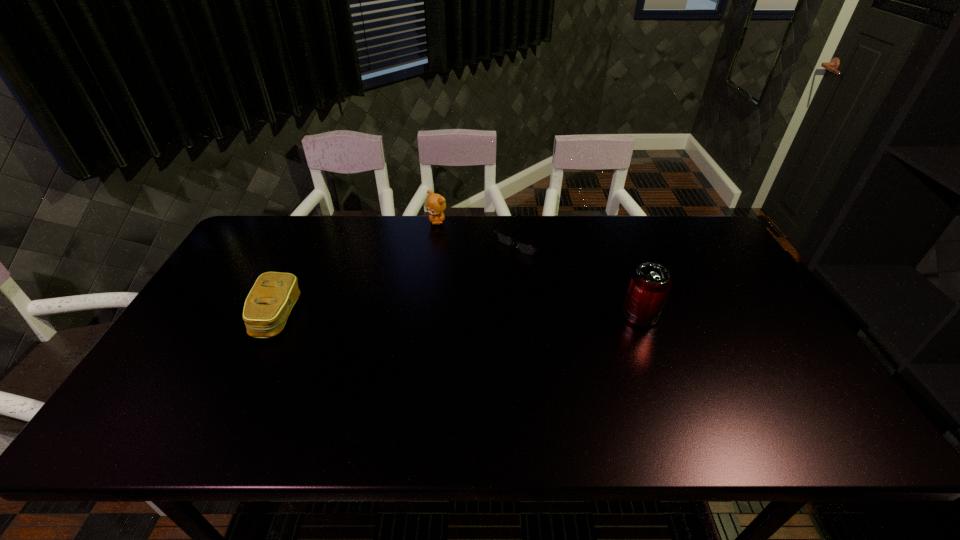
The width and height of the screenshot is (960, 540). In the image, there is a desktop. What are the coordinates of `vacant space at the far edge` in the screenshot? It's located at (599, 247).

The width and height of the screenshot is (960, 540). I want to click on free location at the near edge of the desktop, so click(415, 377).

Image resolution: width=960 pixels, height=540 pixels. What are the coordinates of `vacant area at the left edge of the desktop` in the screenshot? It's located at (266, 272).

Where is `free space at the far left corner`? The image size is (960, 540). free space at the far left corner is located at coordinates (271, 215).

Where is `vacant point located between the tallest object and the shortest object`? This screenshot has width=960, height=540. vacant point located between the tallest object and the shortest object is located at coordinates pyautogui.click(x=584, y=277).

The height and width of the screenshot is (540, 960). I want to click on vacant space in between the second object from left to right and the shortest object, so click(x=482, y=230).

This screenshot has height=540, width=960. Find the location of `empty space that is in between the teddy bear and the rightmost object`. empty space that is in between the teddy bear and the rightmost object is located at coordinates tap(539, 269).

Locate an element on the screen. vacant region between the second object from right to left and the second tallest object is located at coordinates (482, 230).

The image size is (960, 540). In order to click on free spot between the shortest object and the leftmost object in this screenshot , I will do `click(402, 278)`.

The image size is (960, 540). Identify the location of unoccupied area between the second object from right to left and the clutch bag. (402, 278).